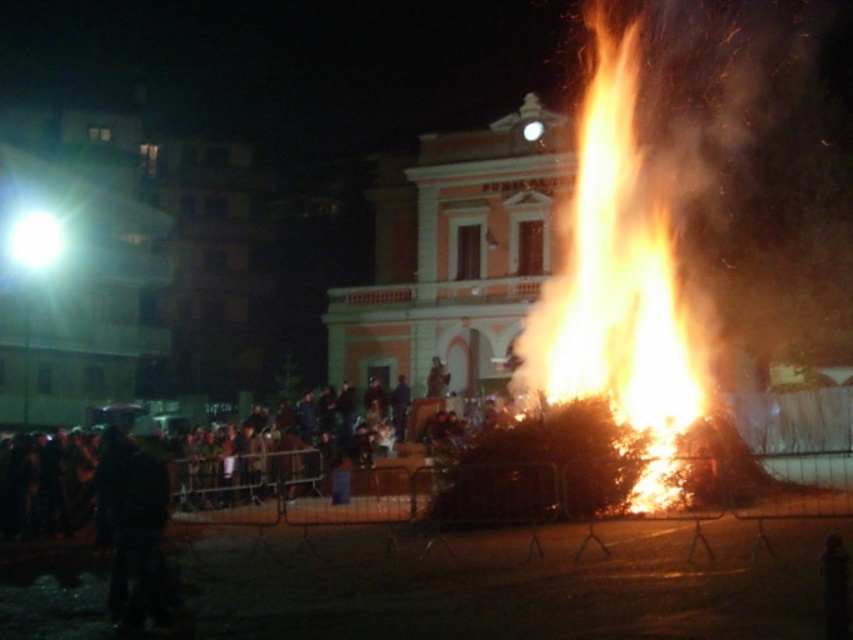
Question: Which of the following is the closest to the observer?

Choices:
 (A) (602, 218)
 (B) (263, 524)

Answer: (B)

Question: Where is flaming wood at center located in relation to dark clothing crowd at lower left in the image?

Choices:
 (A) below
 (B) above

Answer: (B)

Question: Is flaming wood at center further to the viewer compared to dark clothing crowd at lower left?

Choices:
 (A) no
 (B) yes

Answer: (B)

Question: Which point is farther from the camera taking this photo?

Choices:
 (A) (212, 484)
 (B) (604, 256)

Answer: (B)

Question: Does flaming wood at center have a greater width compared to dark clothing crowd at lower left?

Choices:
 (A) no
 (B) yes

Answer: (A)